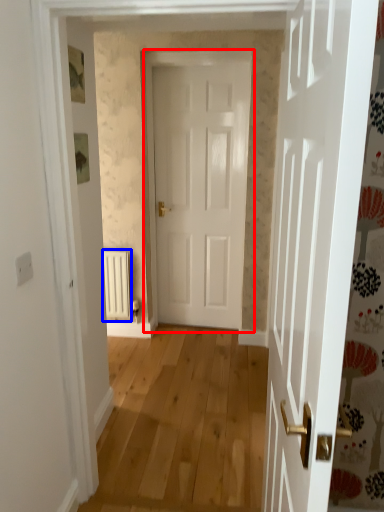
Question: Which object is closer to the camera taking this photo, door (highlighted by a red box) or radiator (highlighted by a blue box)?

Choices:
 (A) door
 (B) radiator

Answer: (A)